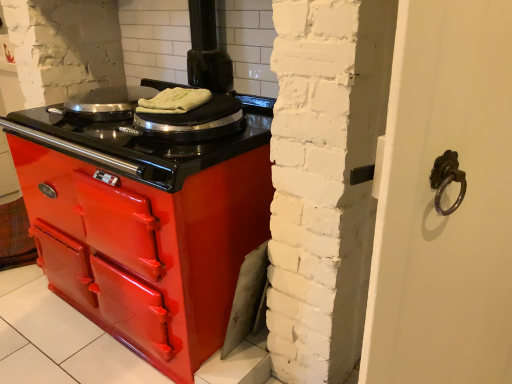
Question: Are shiny metallic pan at upper left and white cloth at center located far from each other?

Choices:
 (A) yes
 (B) no

Answer: (B)

Question: Is shiny metallic pan at upper left taller than white cloth at center?

Choices:
 (A) yes
 (B) no

Answer: (A)

Question: Are shiny metallic pan at upper left and white cloth at center making contact?

Choices:
 (A) yes
 (B) no

Answer: (B)

Question: Does shiny metallic pan at upper left come behind white cloth at center?

Choices:
 (A) no
 (B) yes

Answer: (B)

Question: Is white cloth at center inside shiny metallic pan at upper left?

Choices:
 (A) yes
 (B) no

Answer: (B)

Question: Can you confirm if shiny metallic pan at upper left is thinner than white cloth at center?

Choices:
 (A) no
 (B) yes

Answer: (A)

Question: From the image's perspective, is white cloth at center located above shiny metallic pan at upper left?

Choices:
 (A) yes
 (B) no

Answer: (B)

Question: Is white cloth at center looking in the opposite direction of shiny metallic pan at upper left?

Choices:
 (A) yes
 (B) no

Answer: (B)

Question: From a real-world perspective, does white cloth at center sit lower than shiny metallic pan at upper left?

Choices:
 (A) no
 (B) yes

Answer: (A)

Question: Is white cloth at center shorter than shiny metallic pan at upper left?

Choices:
 (A) yes
 (B) no

Answer: (A)

Question: Does white cloth at center have a smaller size compared to shiny metallic pan at upper left?

Choices:
 (A) yes
 (B) no

Answer: (A)

Question: Is white cloth at center closer to the viewer compared to shiny metallic pan at upper left?

Choices:
 (A) yes
 (B) no

Answer: (A)

Question: Visually, is shiny metallic pan at upper left positioned to the left or to the right of white cloth at center?

Choices:
 (A) left
 (B) right

Answer: (A)